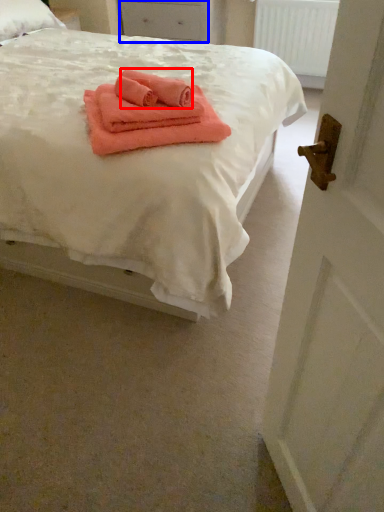
Question: Among these objects, which one is nearest to the camera, cloth (highlighted by a red box) or drawer (highlighted by a blue box)?

Choices:
 (A) cloth
 (B) drawer

Answer: (A)